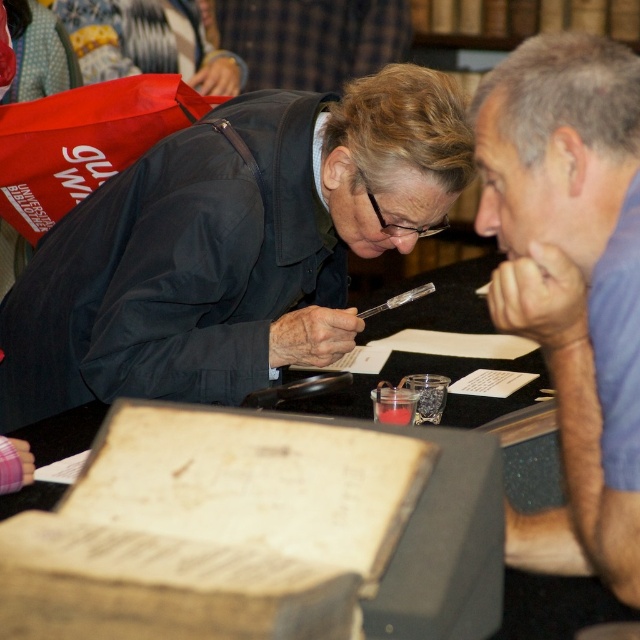
You are standing in the library scene and want to know which person is closer to you based on their height. The people you can see are the dark gray jacket at upper left and the blue cotton shirt at upper right. Which one is taller?

The dark gray jacket at upper left is taller than the blue cotton shirt at upper right, so the dark gray jacket at upper left is taller.

You are a photographer trying to capture a clear shot of the open book in the scene. The dark gray jacket at upper left and the blue cotton shirt at upper right are blocking your view. Which clothing item is wider and thus more obstructing your view?

The dark gray jacket at upper left might be wider than blue cotton shirt at upper right, so it is more likely to be obstructing your view.